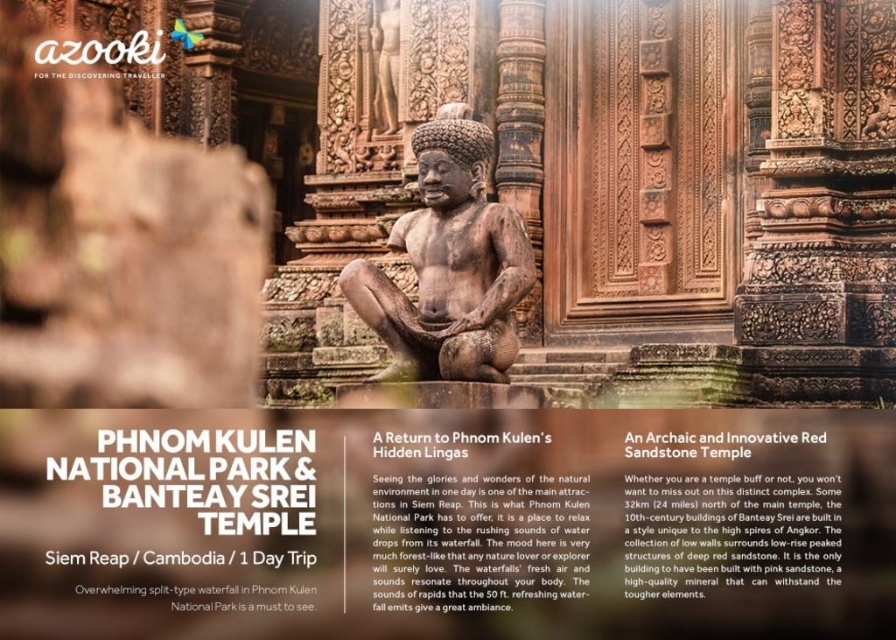
Based on the photo, can you confirm if matte sandstone statue at center is positioned to the right of brown stone statue at center?

Yes, matte sandstone statue at center is to the right of brown stone statue at center.

Between point (329, 472) and point (436, 253), which one is positioned in front?

Point (329, 472) is in front.

Locate an element on the screen. matte sandstone statue at center is located at coordinates (466, 529).